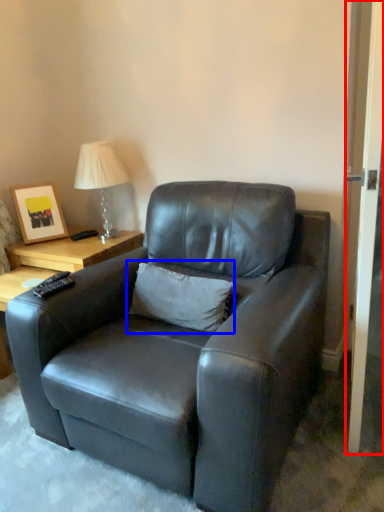
Question: Among these objects, which one is farthest to the camera, screen door (highlighted by a red box) or pillow (highlighted by a blue box)?

Choices:
 (A) screen door
 (B) pillow

Answer: (B)